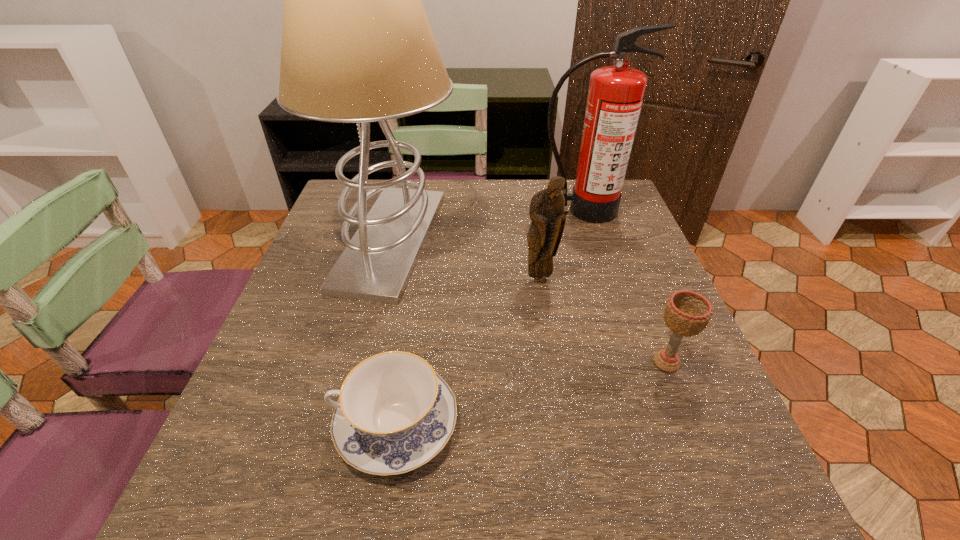
Image resolution: width=960 pixels, height=540 pixels. What are the coordinates of `free point that satisfies the following two spatial constraints: 1. on the front-facing side of the fire extinguisher; 2. on the left side of the chalice` in the screenshot? It's located at (633, 362).

Find the location of a particular element. Image resolution: width=960 pixels, height=540 pixels. free spot that satisfies the following two spatial constraints: 1. on the front-facing side of the second shortest object; 2. on the right side of the fire extinguisher is located at coordinates (633, 362).